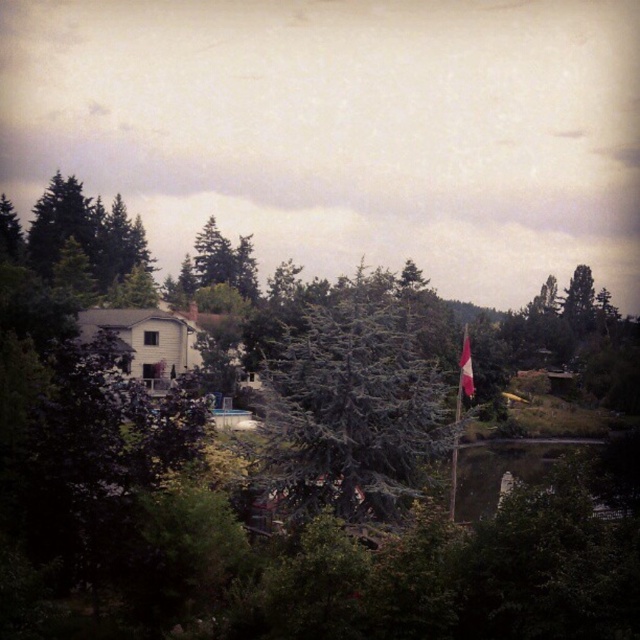
Question: Among these points, which one is farthest from the camera?

Choices:
 (A) (467, 336)
 (B) (476, 490)

Answer: (B)

Question: In this image, where is green needle-like tree at center located relative to metallic flag pole at center-right?

Choices:
 (A) below
 (B) above

Answer: (B)

Question: Which of the following is the farthest from the observer?

Choices:
 (A) (470, 362)
 (B) (397, 388)

Answer: (A)

Question: From the image, what is the correct spatial relationship of green needle-like tree at center in relation to metallic flag pole at center-right?

Choices:
 (A) left
 (B) right

Answer: (A)

Question: In this image, where is clear water at lower center located relative to metallic flag pole at center-right?

Choices:
 (A) right
 (B) left

Answer: (A)

Question: Which object appears farthest from the camera in this image?

Choices:
 (A) metallic flag pole at center-right
 (B) clear water at lower center
 (C) red fabric flag at center-right
 (D) green needle-like tree at center

Answer: (C)